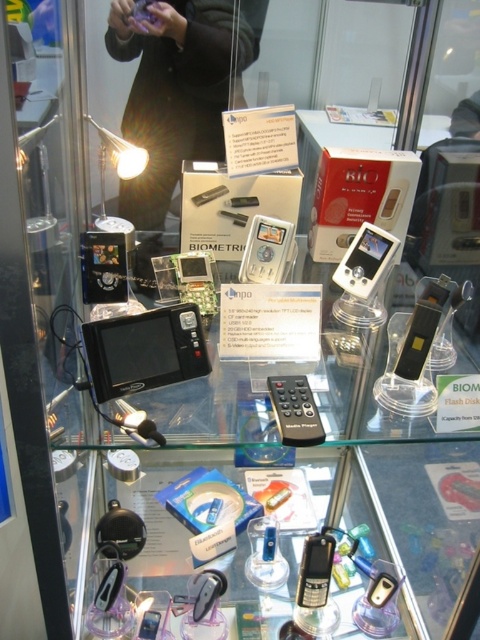
Question: Is matte black camera at upper center further to camera compared to black plastic remote at center?

Choices:
 (A) yes
 (B) no

Answer: (A)

Question: Which point appears closest to the camera in this image?

Choices:
 (A) (268, 266)
 (B) (196, 145)
 (C) (387, 244)
 (D) (100, 284)

Answer: (D)

Question: Can you confirm if black plastic usb flash drive at center is positioned to the right of clear plastic phone at lower center?

Choices:
 (A) yes
 (B) no

Answer: (A)

Question: Considering the real-world distances, which object is farthest from the black plastic usb flash drive at center?

Choices:
 (A) satin silver phone at center
 (B) silver metallic digital camera at center
 (C) matte black camera at upper center

Answer: (C)

Question: Which point is farther to the camera?

Choices:
 (A) (276, 276)
 (B) (90, 324)

Answer: (A)

Question: Does black plastic remote at center appear under clear plastic phone at lower center?

Choices:
 (A) no
 (B) yes

Answer: (A)